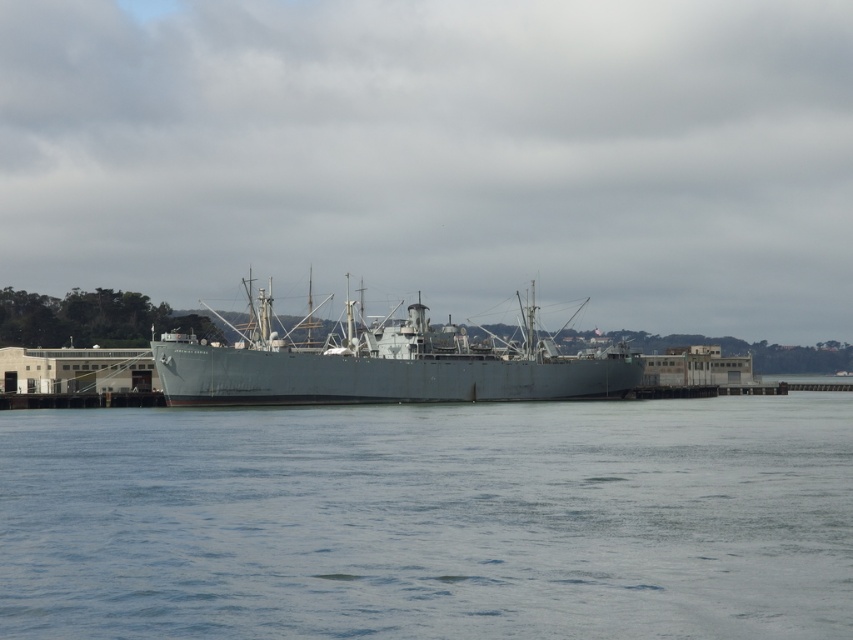
You are standing on the deck of the naval ship and want to move from the point at coordinates point (x=318, y=428) to the point at coordinates point (x=463, y=385). Which direction should you face to walk towards the second point?

Since point (x=318, y=428) is in front of point (x=463, y=385), you should face backward to walk towards the second point.

From the picture: You are standing on the pier next to the naval ship. You want to throw a floating ring to someone in the water at the clear water at center. The floating ring has a throwing range of 60 feet. Can you reach them?

The clear water at center is 66.71 feet away from the viewer. Since the floating ring has a maximum range of 60 feet, you cannot reach the person in the clear water at center as the distance exceeds the ring s throwing capability.